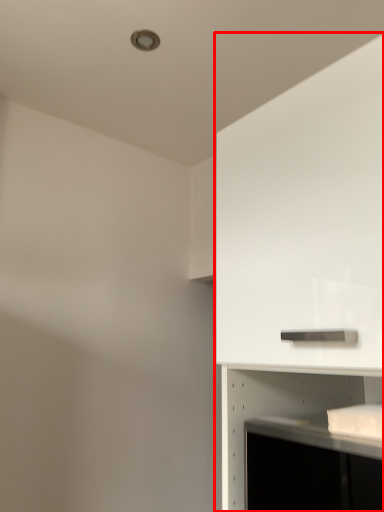
Question: Where is cabinetry (annotated by the red box) located in relation to shelf in the image?

Choices:
 (A) left
 (B) right

Answer: (B)